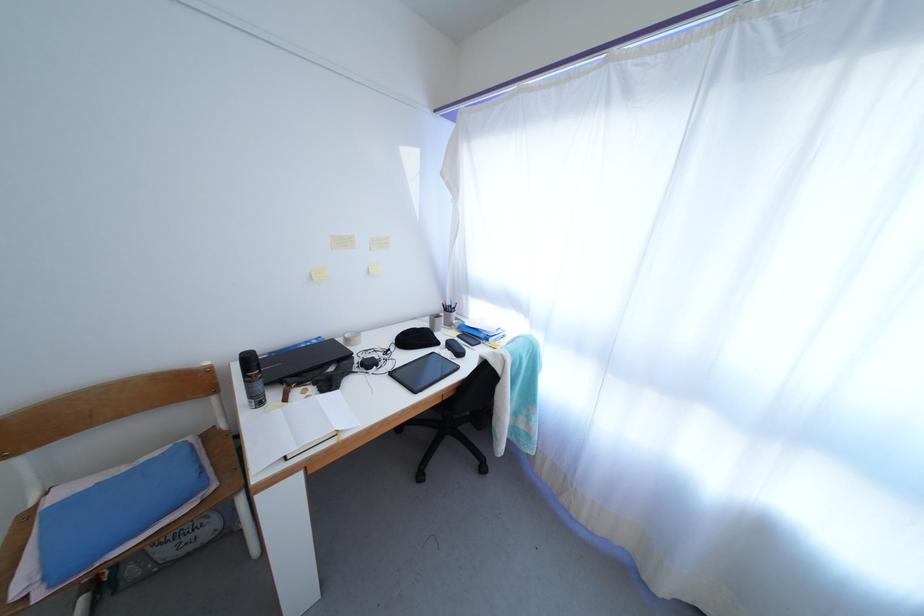
Locate an element on the screen. This screenshot has width=924, height=616. open white notebook is located at coordinates (295, 428).